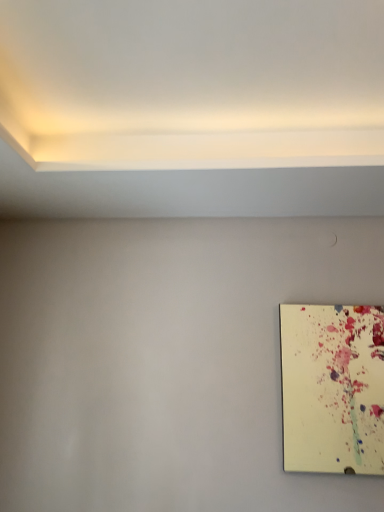
You are a GUI agent. You are given a task and a screenshot of the screen. Output one action in this format:
    pyautogui.click(x=<x>, y=<y>)
    Task: Click on the matte yellow canvas at right
    Image resolution: width=384 pixels, height=512 pixels.
    Given the screenshot: What is the action you would take?
    pyautogui.click(x=332, y=388)

This screenshot has height=512, width=384. What do you see at coordinates (332, 388) in the screenshot?
I see `matte yellow canvas at right` at bounding box center [332, 388].

Find the location of `matte yellow canvas at right`. matte yellow canvas at right is located at coordinates (332, 388).